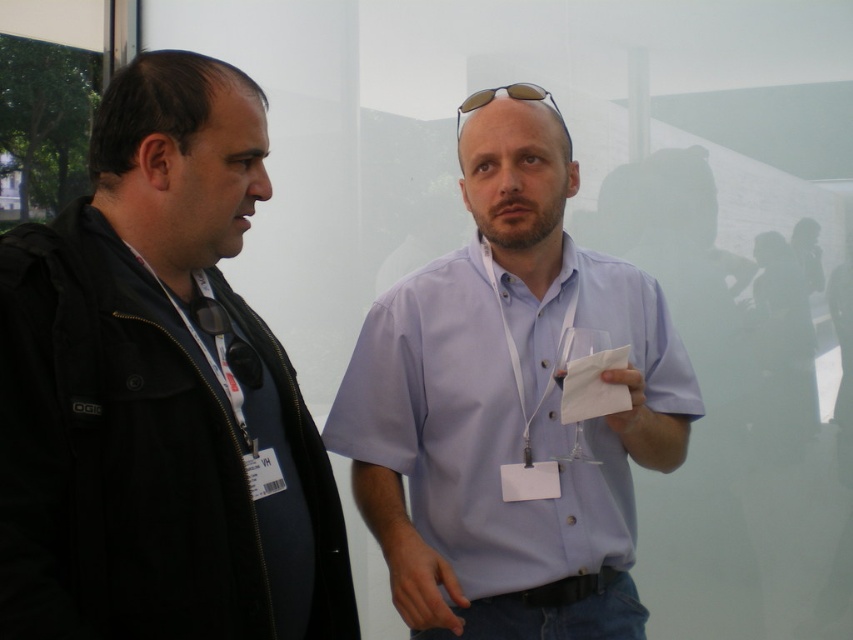
Does point (291, 524) come in front of point (463, 106)?

That is True.

Does black matte jacket at left have a greater height compared to sunglasses at center?

Yes, black matte jacket at left is taller than sunglasses at center.

What do you see at coordinates (160, 392) in the screenshot? This screenshot has height=640, width=853. I see `black matte jacket at left` at bounding box center [160, 392].

This screenshot has height=640, width=853. Identify the location of black matte jacket at left. pyautogui.click(x=160, y=392).

Between black matte jacket at left and light blue shirt at center, which one has less height?

Standing shorter between the two is black matte jacket at left.

Where is `black matte jacket at left`? The width and height of the screenshot is (853, 640). black matte jacket at left is located at coordinates (160, 392).

Is point (39, 296) positioned behind point (550, 353)?

That is False.

In order to click on black matte jacket at left in this screenshot , I will do `click(160, 392)`.

Is point (537, 276) in front of point (535, 84)?

No, (537, 276) is behind (535, 84).

Is light blue shirt at center above sunglasses at center?

Incorrect, light blue shirt at center is not positioned above sunglasses at center.

Where is `light blue shirt at center`? The image size is (853, 640). light blue shirt at center is located at coordinates [509, 410].